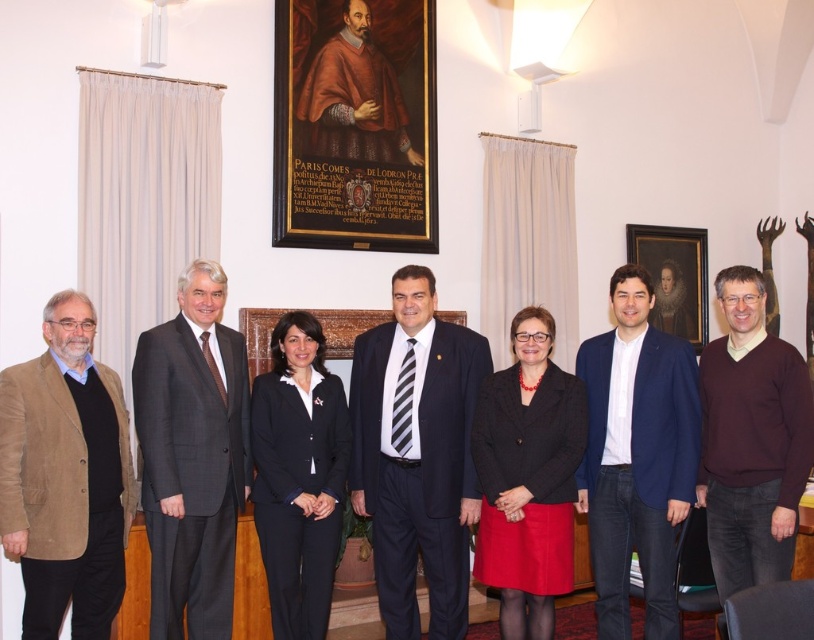
You are standing in the conference room and want to find the maroon sweater at center. According to the coordinates provided, where should you look?

The maroon sweater at center is located at point (751, 440).

You are a photographer adjusting the lighting for a group photo. You notice two central figures wearing the dark gray suit at center and the matte black blazer at center. Which clothing item should you focus on first to ensure proper exposure, considering their vertical positions?

The dark gray suit at center is located above the matte black blazer at center, so you should focus on the dark gray suit at center first since it is higher up and might be in a different light zone.